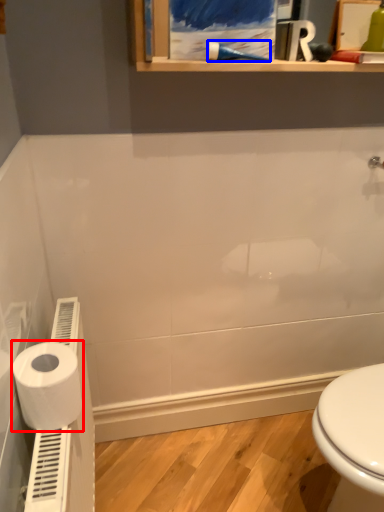
Question: Which of the following is the closest to the observer, toilet paper (highlighted by a red box) or shower (highlighted by a blue box)?

Choices:
 (A) toilet paper
 (B) shower

Answer: (A)